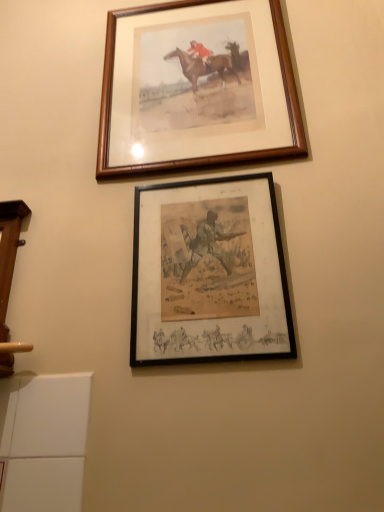
What is the approximate height of wooden frame at upper center, acting as the 1th picture frame starting from the top?

25.48 inches.

Describe the element at coordinates (197, 88) in the screenshot. I see `wooden frame at upper center, placed as the 2th picture frame when sorted from bottom to top` at that location.

Where is `wooden frame at upper center, acting as the 1th picture frame starting from the top`? wooden frame at upper center, acting as the 1th picture frame starting from the top is located at coordinates (197, 88).

How much space does wooden frame at upper center, acting as the 1th picture frame starting from the top, occupy horizontally?

wooden frame at upper center, acting as the 1th picture frame starting from the top, is 1.96 inches in width.

In order to face wooden frame at upper center, acting as the 1th picture frame starting from the top, should I rotate leftwards or rightwards?

A 0.374 degree turn to the right will do.

Locate an element on the screen. This screenshot has height=512, width=384. black matte picture frame at center, acting as the second picture frame starting from the back is located at coordinates (209, 273).

Measure the distance between black matte picture frame at center, which is the 2th picture frame in top-to-bottom order, and camera.

black matte picture frame at center, which is the 2th picture frame in top-to-bottom order, is 32.73 inches away from camera.

Describe the element at coordinates (209, 273) in the screenshot. I see `black matte picture frame at center, which ranks as the 1th picture frame in bottom-to-top order` at that location.

Image resolution: width=384 pixels, height=512 pixels. Identify the location of wooden frame at upper center, acting as the 1th picture frame starting from the top. (197, 88).

Between black matte picture frame at center, acting as the second picture frame starting from the back, and wooden frame at upper center, positioned as the 2th picture frame in front-to-back order, which one appears on the right side from the viewer's perspective?

black matte picture frame at center, acting as the second picture frame starting from the back.

Between black matte picture frame at center, the 1th picture frame positioned from the front, and wooden frame at upper center, positioned as the 2th picture frame in front-to-back order, which one is positioned in front?

black matte picture frame at center, the 1th picture frame positioned from the front, is in front.

Considering the points (158, 357) and (127, 131), which point is in front, point (158, 357) or point (127, 131)?

The point (158, 357) is closer to the camera.

From the image's perspective, does black matte picture frame at center, which ranks as the 1th picture frame in bottom-to-top order, appear higher than wooden frame at upper center, positioned as the 2th picture frame in front-to-back order?

No, from the image's perspective, black matte picture frame at center, which ranks as the 1th picture frame in bottom-to-top order, is not above wooden frame at upper center, positioned as the 2th picture frame in front-to-back order.

From a real-world perspective, is black matte picture frame at center, which is the 2th picture frame in top-to-bottom order, physically below wooden frame at upper center, placed as the 2th picture frame when sorted from bottom to top?

Yes, from a real-world perspective, black matte picture frame at center, which is the 2th picture frame in top-to-bottom order, is beneath wooden frame at upper center, placed as the 2th picture frame when sorted from bottom to top.

Is black matte picture frame at center, which ranks as the 1th picture frame in bottom-to-top order, thinner than wooden frame at upper center, positioned as the 2th picture frame in front-to-back order?

Yes, black matte picture frame at center, which ranks as the 1th picture frame in bottom-to-top order, is thinner than wooden frame at upper center, positioned as the 2th picture frame in front-to-back order.

Does black matte picture frame at center, the 1th picture frame positioned from the front, have a greater height compared to wooden frame at upper center, positioned as the 2th picture frame in front-to-back order?

No, black matte picture frame at center, the 1th picture frame positioned from the front, is not taller than wooden frame at upper center, positioned as the 2th picture frame in front-to-back order.

Does black matte picture frame at center, which ranks as the 1th picture frame in bottom-to-top order, have a smaller size compared to wooden frame at upper center, placed as the 2th picture frame when sorted from bottom to top?

Correct, black matte picture frame at center, which ranks as the 1th picture frame in bottom-to-top order, occupies less space than wooden frame at upper center, placed as the 2th picture frame when sorted from bottom to top.

Is black matte picture frame at center, which is the 2th picture frame in top-to-bottom order, situated inside wooden frame at upper center, positioned as the 2th picture frame in front-to-back order, or outside?

black matte picture frame at center, which is the 2th picture frame in top-to-bottom order, is located beyond the bounds of wooden frame at upper center, positioned as the 2th picture frame in front-to-back order.

Is black matte picture frame at center, acting as the second picture frame starting from the back, far away from wooden frame at upper center, acting as the 1th picture frame starting from the top?

black matte picture frame at center, acting as the second picture frame starting from the back, is actually quite close to wooden frame at upper center, acting as the 1th picture frame starting from the top.

Is black matte picture frame at center, acting as the second picture frame starting from the back, looking in the opposite direction of wooden frame at upper center, positioned as the 2th picture frame in front-to-back order?

No, black matte picture frame at center, acting as the second picture frame starting from the back, is not facing the opposite direction of wooden frame at upper center, positioned as the 2th picture frame in front-to-back order.

Where is `picture frame below the wooden frame at upper center, positioned as the 2th picture frame in front-to-back order (from the image's perspective)`? The width and height of the screenshot is (384, 512). picture frame below the wooden frame at upper center, positioned as the 2th picture frame in front-to-back order (from the image's perspective) is located at coordinates (209, 273).

Is wooden frame at upper center, the first picture frame viewed from the back, to the right of black matte picture frame at center, the 1th picture frame positioned from the front, from the viewer's perspective?

No, wooden frame at upper center, the first picture frame viewed from the back, is not to the right of black matte picture frame at center, the 1th picture frame positioned from the front.

Which object is more forward, wooden frame at upper center, acting as the 1th picture frame starting from the top, or black matte picture frame at center, the 1th picture frame positioned from the front?

Positioned in front is black matte picture frame at center, the 1th picture frame positioned from the front.

Considering the points (206, 164) and (212, 276), which point is in front, point (206, 164) or point (212, 276)?

Point (212, 276)

From the image's perspective, which is below, wooden frame at upper center, placed as the 2th picture frame when sorted from bottom to top, or black matte picture frame at center, which ranks as the 1th picture frame in bottom-to-top order?

black matte picture frame at center, which ranks as the 1th picture frame in bottom-to-top order, from the image's perspective.

From a real-world perspective, which object rests below the other?

black matte picture frame at center, the 1th picture frame positioned from the front, is physically lower.

Which object is thinner, wooden frame at upper center, placed as the 2th picture frame when sorted from bottom to top, or black matte picture frame at center, the 1th picture frame positioned from the front?

black matte picture frame at center, the 1th picture frame positioned from the front, is thinner.

Between wooden frame at upper center, placed as the 2th picture frame when sorted from bottom to top, and black matte picture frame at center, acting as the second picture frame starting from the back, which one has more height?

wooden frame at upper center, placed as the 2th picture frame when sorted from bottom to top, is taller.

Does wooden frame at upper center, positioned as the 2th picture frame in front-to-back order, have a larger size compared to black matte picture frame at center, acting as the second picture frame starting from the back?

Yes.

Is wooden frame at upper center, positioned as the 2th picture frame in front-to-back order, spatially inside black matte picture frame at center, which is the 2th picture frame in top-to-bottom order, or outside of it?

wooden frame at upper center, positioned as the 2th picture frame in front-to-back order, exists outside the volume of black matte picture frame at center, which is the 2th picture frame in top-to-bottom order.

In the scene shown: Would you say wooden frame at upper center, positioned as the 2th picture frame in front-to-back order, is a long distance from black matte picture frame at center, acting as the second picture frame starting from the back?

Answer: No, wooden frame at upper center, positioned as the 2th picture frame in front-to-back order, is in close proximity to black matte picture frame at center, acting as the second picture frame starting from the back.

Consider the image. Does wooden frame at upper center, the first picture frame viewed from the back, turn towards black matte picture frame at center, acting as the second picture frame starting from the back?

No, wooden frame at upper center, the first picture frame viewed from the back, does not turn towards black matte picture frame at center, acting as the second picture frame starting from the back.

The image size is (384, 512). Find the location of `picture frame below the wooden frame at upper center, acting as the 1th picture frame starting from the top (from the image's perspective)`. picture frame below the wooden frame at upper center, acting as the 1th picture frame starting from the top (from the image's perspective) is located at coordinates (209, 273).

Locate an element on the screen. The height and width of the screenshot is (512, 384). picture frame below the wooden frame at upper center, placed as the 2th picture frame when sorted from bottom to top (from the image's perspective) is located at coordinates (209, 273).

Locate an element on the screen. The height and width of the screenshot is (512, 384). picture frame above the black matte picture frame at center, the 1th picture frame positioned from the front (from the image's perspective) is located at coordinates click(197, 88).